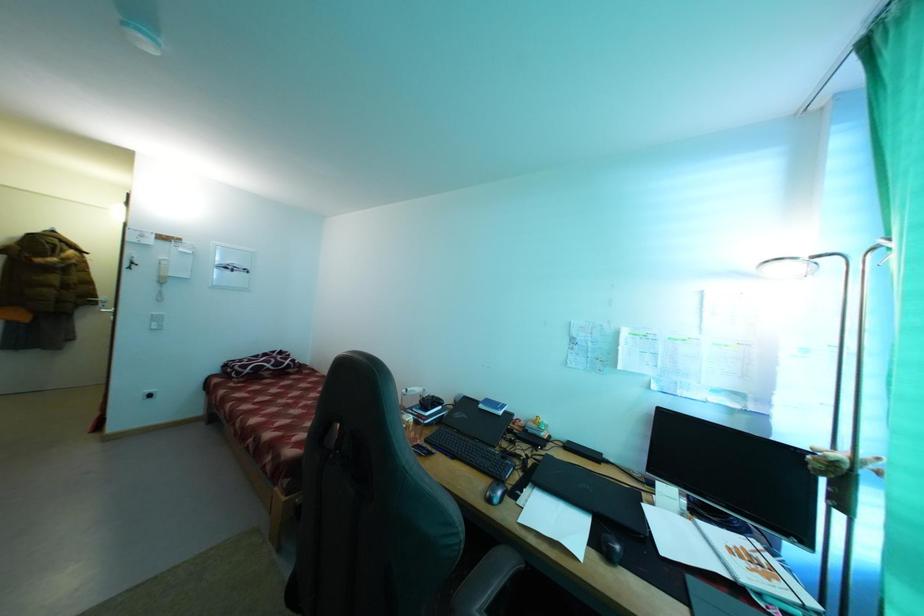
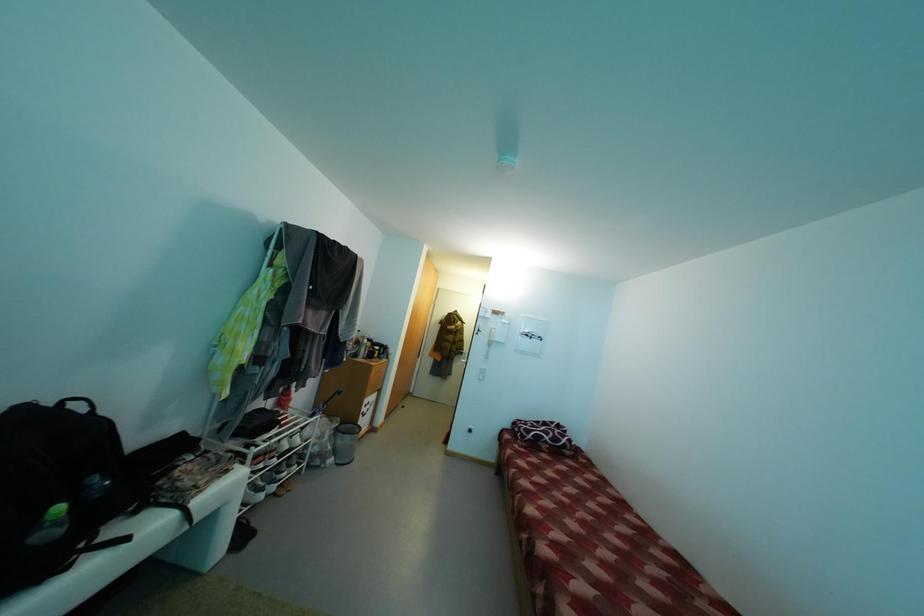
Question: Based on the continuous images, in which direction is the camera rotating? Reply with the corresponding letter.

Choices:
 (A) Left
 (B) Right
 (C) Up
 (D) Down

Answer: (A)